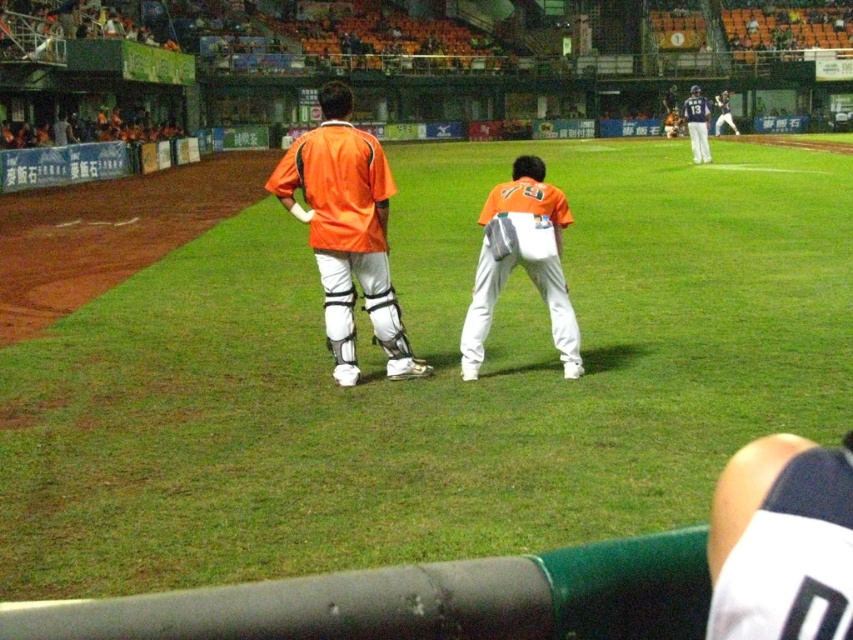
You are a photographer trying to capture the player in white matte pants at center for a closeup shot. Given that your camera has a focal length of 200mm and you are positioned at point A, which is at coordinates 0.3, 0.3, can you determine if the pants are within your camera frame? Assume the frame covers an area from 0.4 to 0.7 in both x and y axes.

The white matte pants at center is located at point (431, 378), which falls within the camera frame covering 0.4 to 0.7 in both x and y axes. Therefore, the pants are within the frame.

Based on the photo, you are a photographer standing at the edge of the baseball field. You want to capture a closeup shot of the white matte baseball uniform at center. Given that your camera can focus on objects within 4 feet, will you be able to take the photo without moving closer?

The white matte baseball uniform at center is 4.36 feet away from the camera. Since the camera can focus within 4 feet, the distance is slightly beyond the focus range. Therefore, you won

You are a photographer trying to capture a clear shot of both the white matte pants at center and the white matte baseball uniform at center. Based on their positions, which one is closer to the camera?

The white matte pants at center are closer to the camera because the white matte baseball uniform at center is behind them.